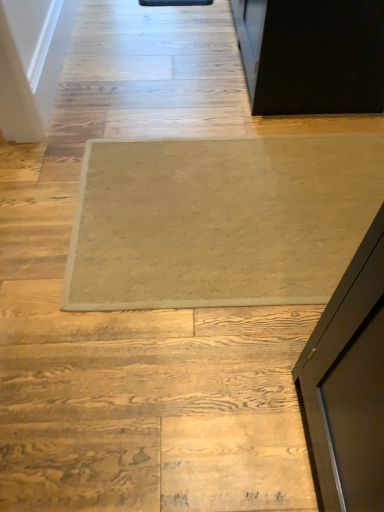
Locate an element on the screen. free space above beige carpet at center (from a real-world perspective) is located at coordinates pyautogui.click(x=244, y=202).